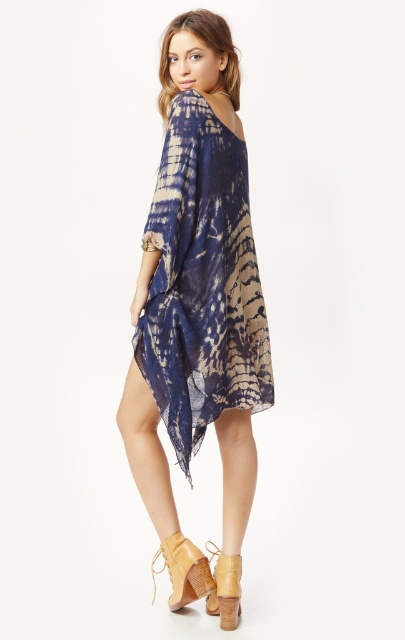
You are a fashion stylist helping a client choose between the tan suede boot at lower center and the matte tan leather sandal at lower center. Which option is taller?

The tan suede boot at lower center is taller than the matte tan leather sandal at lower center.